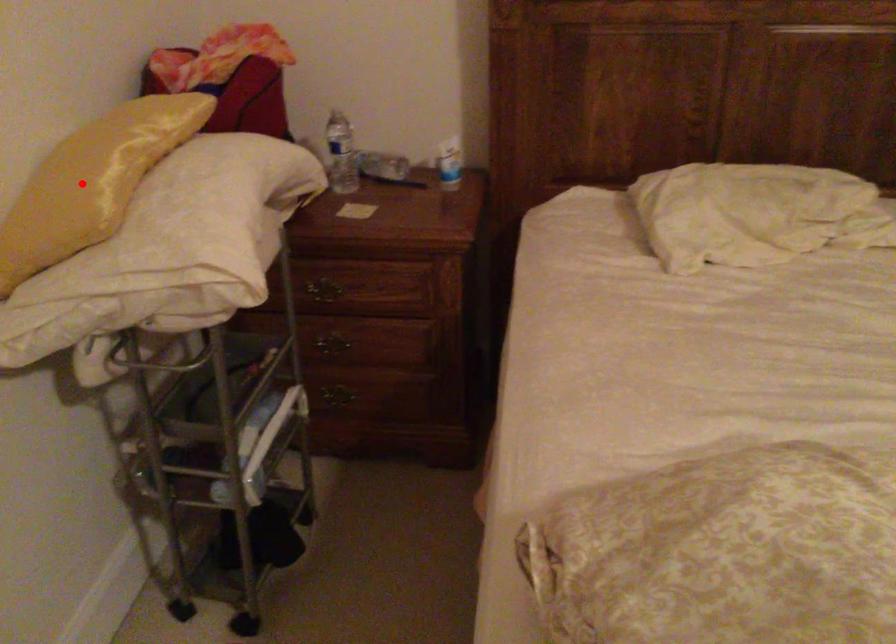
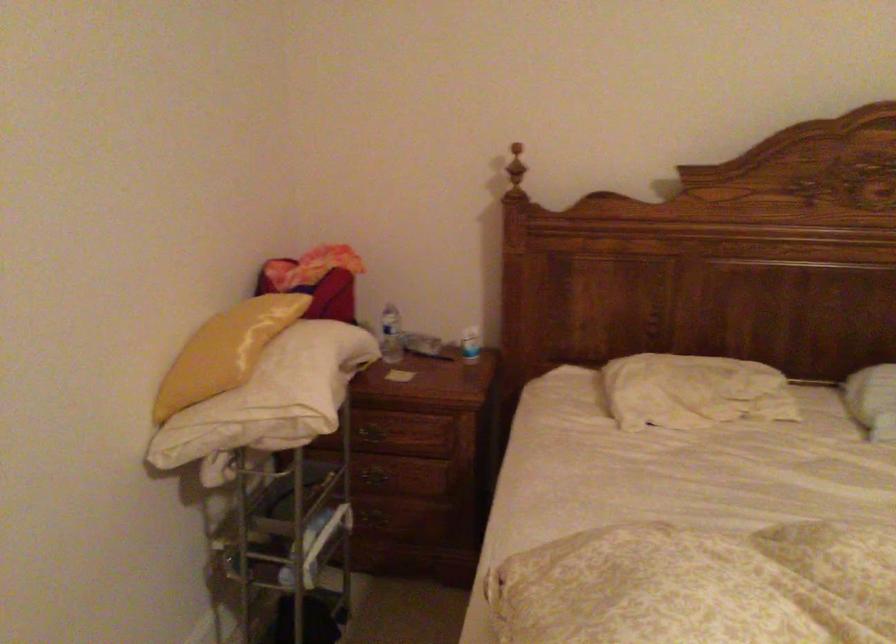
Question: I am providing you with two images of the same scene from different viewpoints. Given a red point in image1, look at the same physical point in image2. Is it:

Choices:
 (A) Closer to the viewpoint
 (B) Farther from the viewpoint

Answer: (B)